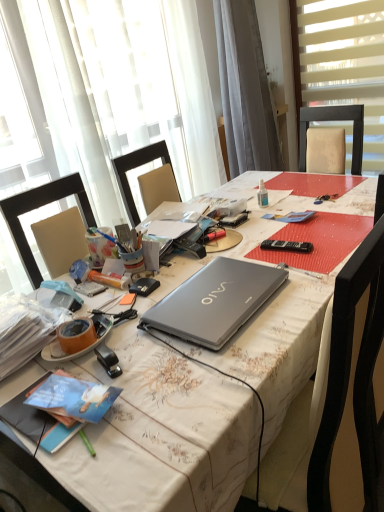
This screenshot has width=384, height=512. Find the location of `free spot to the left of silver metallic laptop at center`. free spot to the left of silver metallic laptop at center is located at coordinates (129, 328).